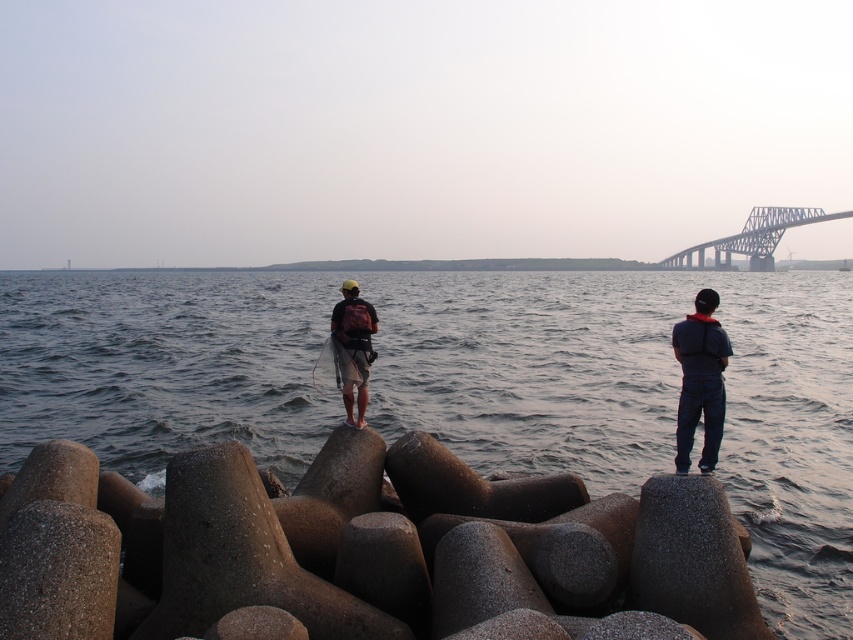
You are a photographer planning to take a photo of the gray metallic bridge at upper right and the matte black backpack at center. Which object should you focus on first if you want to capture both in the same frame without moving the camera?

The gray metallic bridge at upper right is positioned over the matte black backpack at center, so you should focus on the gray metallic bridge at upper right first to ensure both are in the frame.

You are a photographer planning to take a photo of the gray concrete water at center located at point (642, 397). You want to ensure that the two people on the tetrapods are not in the frame. Based on their positions relative to the water, can you confirm if they are blocking the view of the gray concrete water at center?

The gray concrete water at center is located at point (642, 397). Since the two individuals are standing on the tetrapods facing away from the camera towards the water, their positions are likely between the camera and the water, which means they might be blocking the view of the gray concrete water at center. To avoid them, you should adjust your position to frame around them or wait until they move.

You are standing on the gray concrete water at center and want to reach the gray metallic bridge at upper right. Which direction should you go to get there?

The gray metallic bridge at upper right is above the gray concrete water at center, so you should go upwards to reach it.